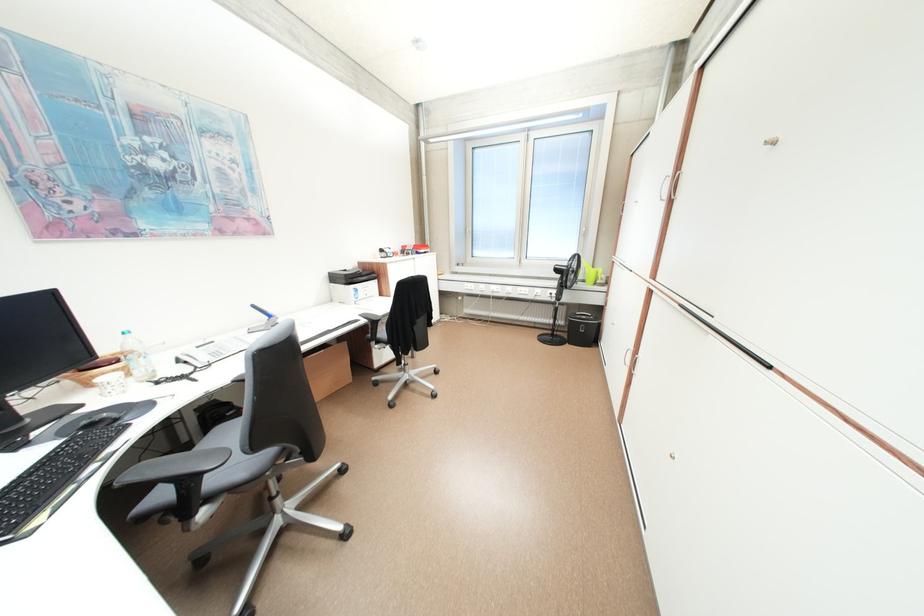
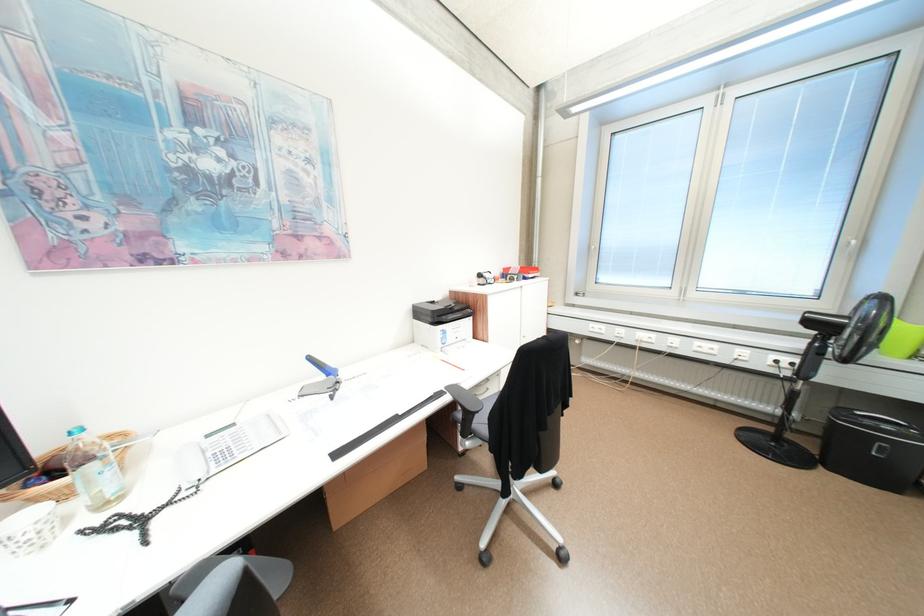
Find the pixel in the second image that matches point 431,246 in the first image.

(538, 269)